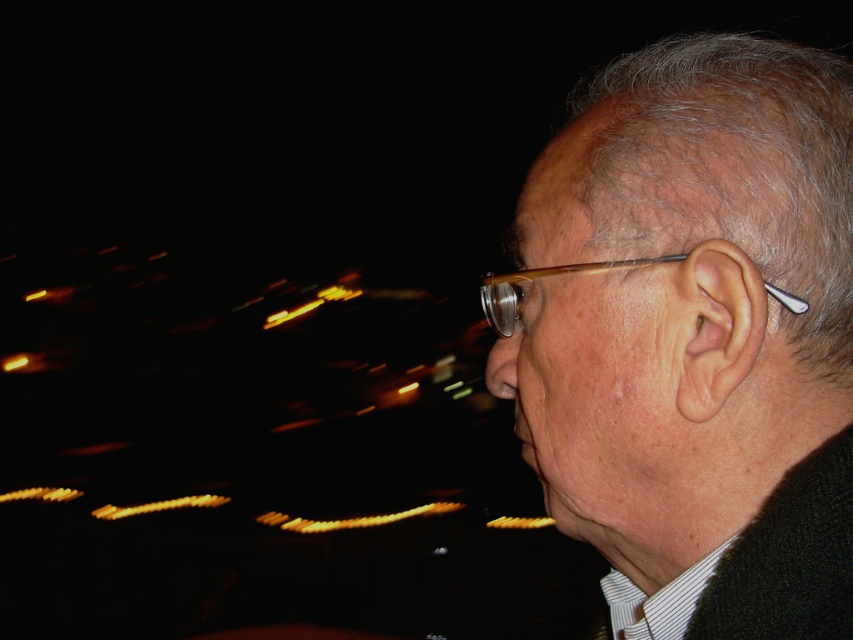
Who is positioned more to the left, matte black earbud at right or matte brown glasses at ear?

matte brown glasses at ear is more to the left.

How distant is matte black earbud at right from matte brown glasses at ear?

6.82 centimeters

Describe the element at coordinates (693, 337) in the screenshot. This screenshot has height=640, width=853. I see `matte black earbud at right` at that location.

The image size is (853, 640). In order to click on matte black earbud at right in this screenshot , I will do `click(693, 337)`.